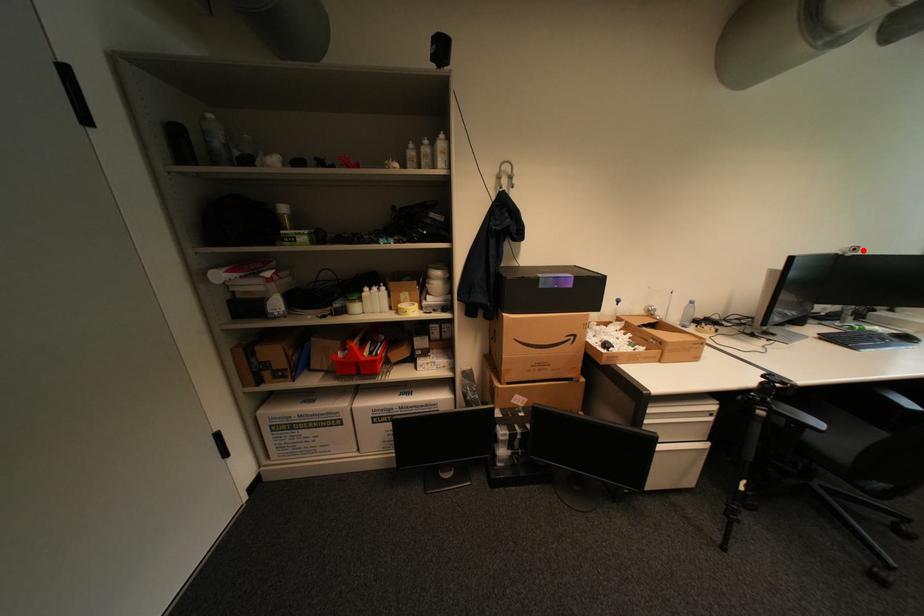
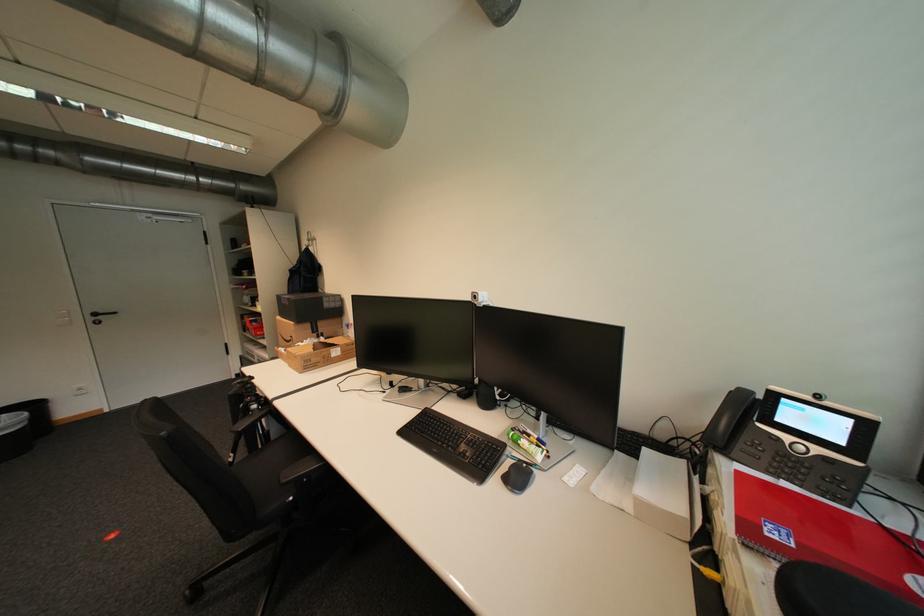
In the second image, find the point that corresponds to the highlighted location in the first image.

(483, 297)